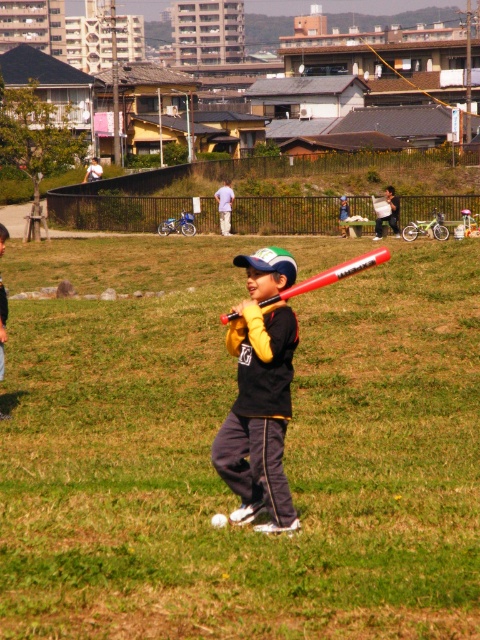
Who is positioned more to the right, rubberized red bat at center or white fuzzy baseball at center?

rubberized red bat at center

Does point (268, 300) come behind point (216, 528)?

No, it is not.

Who is more distant from viewer, (330,276) or (212,520)?

Point (212,520)

At what (x,y) coordinates should I click in order to perform the action: click on rubberized red bat at center. Please return your answer as a coordinate pair (x, y). Image resolution: width=480 pixels, height=640 pixels. Looking at the image, I should click on (331, 275).

Describe the element at coordinates (260, 394) in the screenshot. I see `matte black baseball bat at center` at that location.

Between matte black baseball bat at center and rubberized red bat at center, which one has more height?

rubberized red bat at center

Image resolution: width=480 pixels, height=640 pixels. I want to click on matte black baseball bat at center, so click(260, 394).

From the picture: Which of these two, matte black baseball bat at center or white fuzzy baseball at center, stands shorter?

With less height is white fuzzy baseball at center.

Is point (274, 284) positioned behind point (215, 516)?

No, it is not.

Is point (228, 476) positioned after point (212, 522)?

No, it is not.

Find the location of a particular element. matte black baseball bat at center is located at coordinates (260, 394).